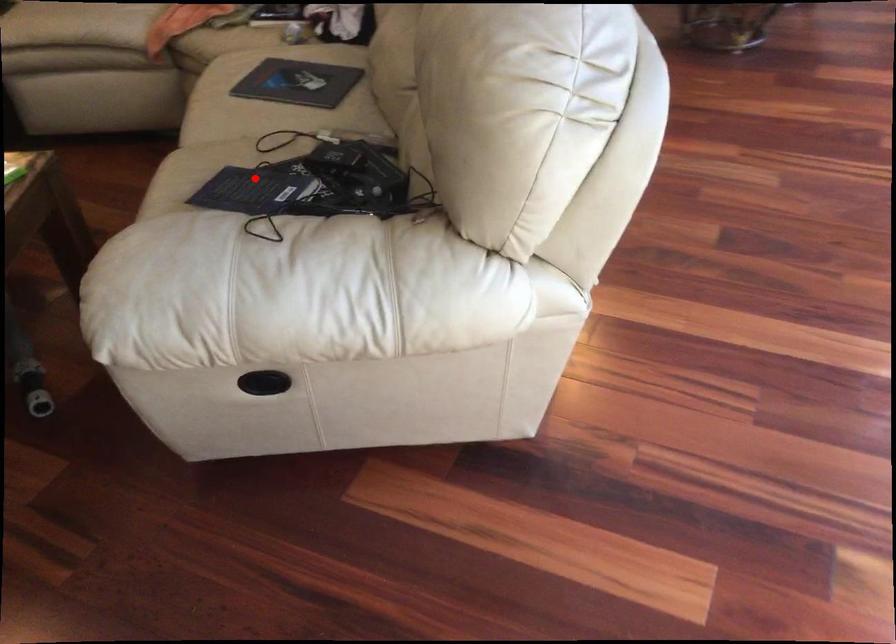
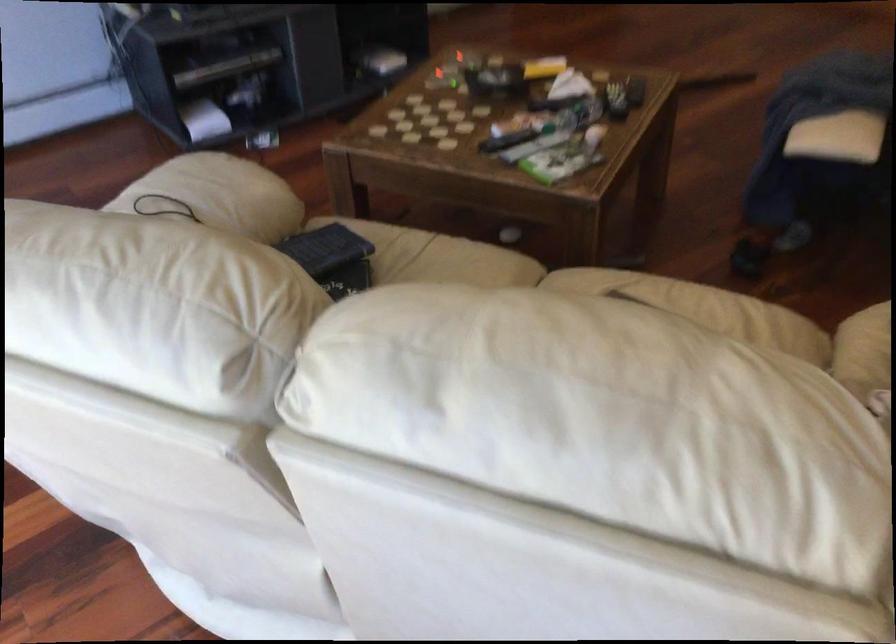
Locate, in the second image, the point that corresponds to the highlighted location in the first image.

(325, 249)